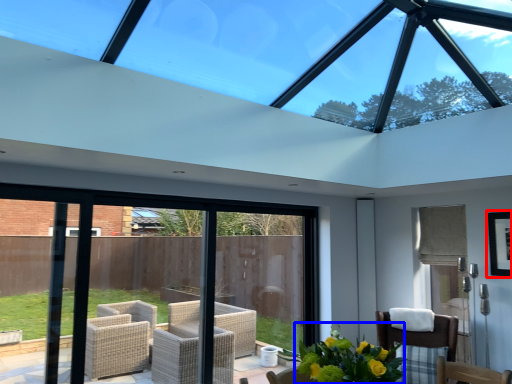
Question: Which object is closer to the camera taking this photo, picture frame (highlighted by a red box) or floral arrangement (highlighted by a blue box)?

Choices:
 (A) picture frame
 (B) floral arrangement

Answer: (B)